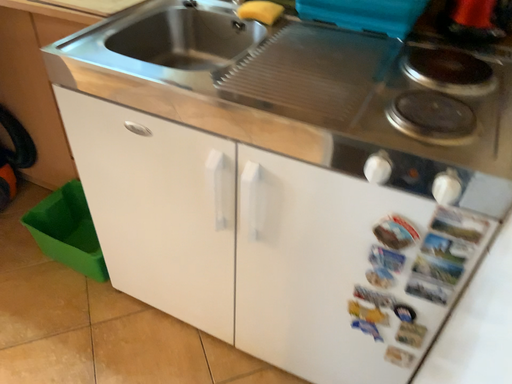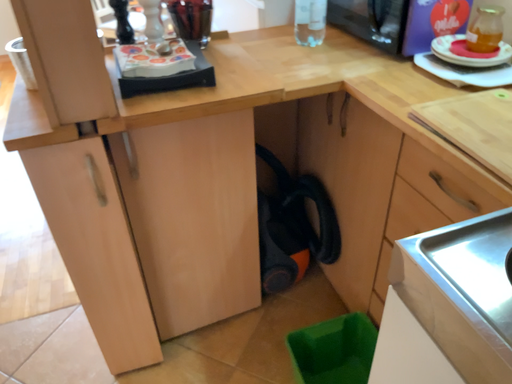
Question: How did the camera likely rotate when shooting the video?

Choices:
 (A) rotated downward
 (B) rotated upward

Answer: (B)